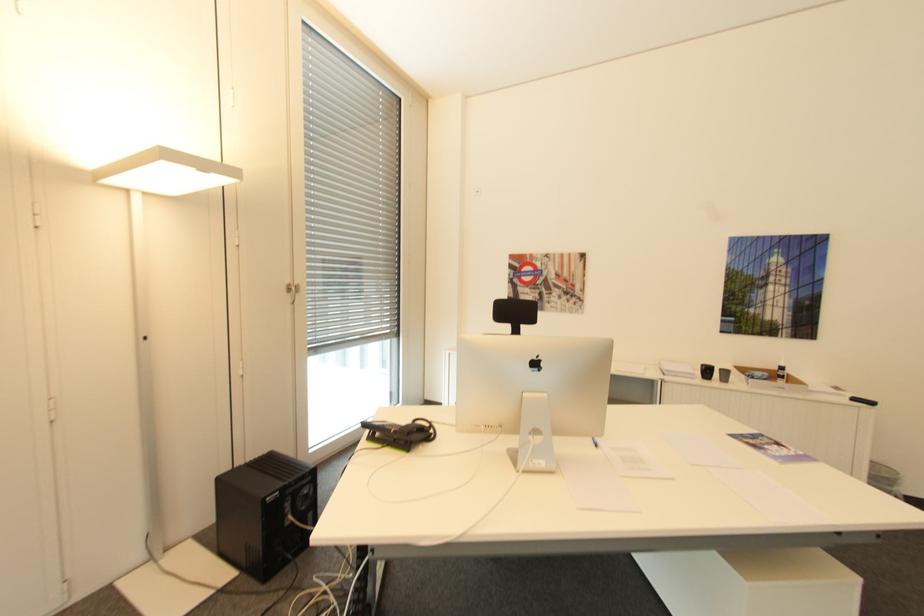
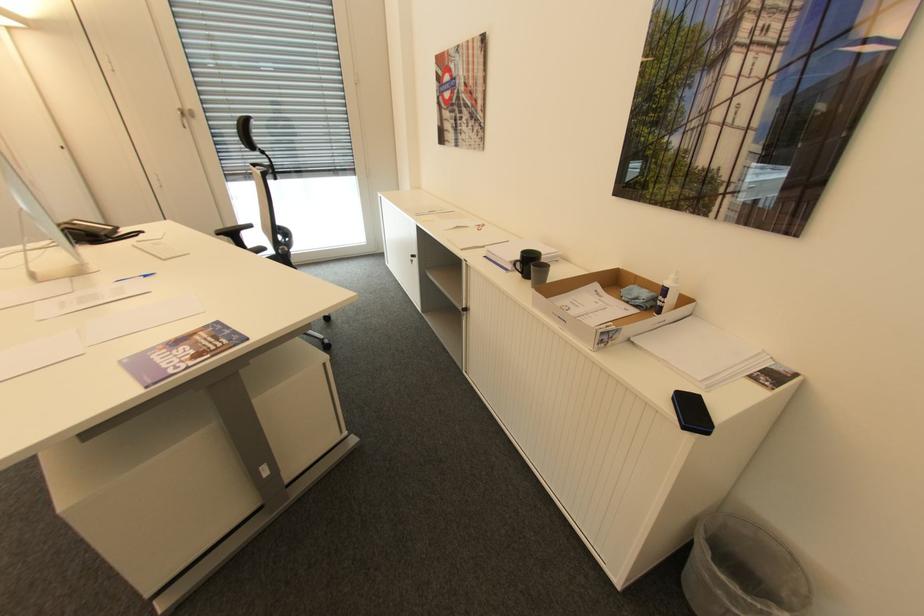
The point at (786, 368) is marked in the first image. Where is the corresponding point in the second image?

(670, 291)